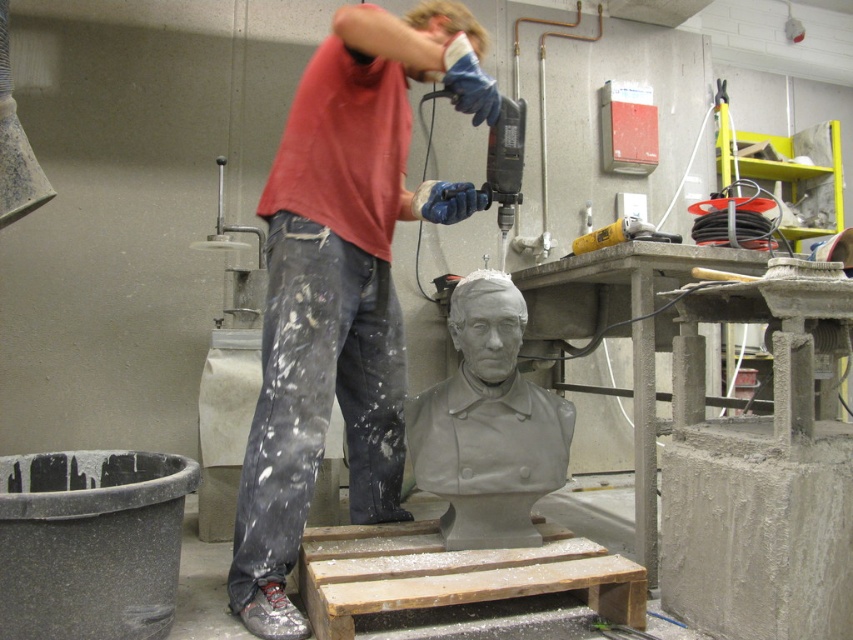
Based on the photo, you are standing in the workshop and need to reach both the point at coordinates point(346, 8) and point(663, 241). Which point should you reach first to minimize the distance traveled?

You should reach point(346, 8) first because it is closer to you than point(663, 241).

You are standing in the workshop and want to place a new tool on the gray matte bust at center. Can you confirm the exact coordinates where you should place it?

The gray matte bust at center is located at coordinates (488, 424), so place the tool there.